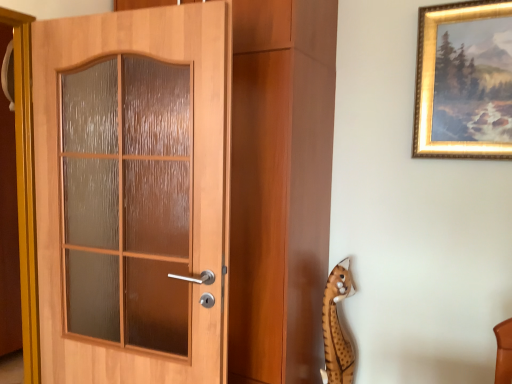
Question: Should I look upward or downward to see gold-framed painting at upper right?

Choices:
 (A) up
 (B) down

Answer: (A)

Question: From a real-world perspective, is gold-framed painting at upper right on spotted plush toy at lower right?

Choices:
 (A) no
 (B) yes

Answer: (B)

Question: Does gold-framed painting at upper right have a greater width compared to spotted plush toy at lower right?

Choices:
 (A) no
 (B) yes

Answer: (A)

Question: Is gold-framed painting at upper right far from spotted plush toy at lower right?

Choices:
 (A) yes
 (B) no

Answer: (B)

Question: Considering the relative positions of gold-framed painting at upper right and spotted plush toy at lower right in the image provided, is gold-framed painting at upper right to the left of spotted plush toy at lower right from the viewer's perspective?

Choices:
 (A) no
 (B) yes

Answer: (A)

Question: Is gold-framed painting at upper right placed right next to spotted plush toy at lower right?

Choices:
 (A) yes
 (B) no

Answer: (B)

Question: Does gold-framed painting at upper right have a lesser width compared to spotted plush toy at lower right?

Choices:
 (A) yes
 (B) no

Answer: (A)

Question: Is spotted plush toy at lower right thinner than gold-framed painting at upper right?

Choices:
 (A) yes
 (B) no

Answer: (B)

Question: Does spotted plush toy at lower right have a greater height compared to gold-framed painting at upper right?

Choices:
 (A) yes
 (B) no

Answer: (B)

Question: Is spotted plush toy at lower right next to gold-framed painting at upper right and touching it?

Choices:
 (A) yes
 (B) no

Answer: (B)

Question: Is spotted plush toy at lower right at the left side of gold-framed painting at upper right?

Choices:
 (A) yes
 (B) no

Answer: (A)

Question: From a real-world perspective, does spotted plush toy at lower right sit lower than gold-framed painting at upper right?

Choices:
 (A) yes
 (B) no

Answer: (A)

Question: From the image's perspective, is spotted plush toy at lower right located above gold-framed painting at upper right?

Choices:
 (A) no
 (B) yes

Answer: (A)

Question: Is wooden door at left a part of gold-framed painting at upper right?

Choices:
 (A) no
 (B) yes

Answer: (A)